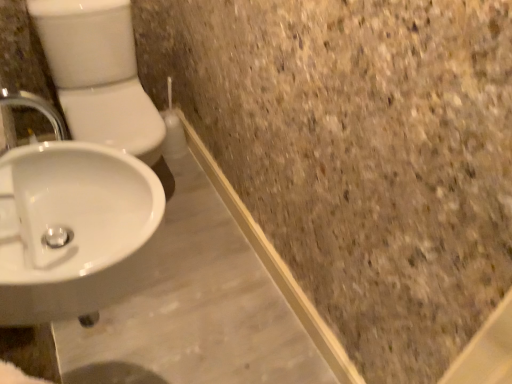
The image size is (512, 384). Describe the element at coordinates (98, 74) in the screenshot. I see `white glossy toilet bowl at left` at that location.

What are the coordinates of `white glossy toilet bowl at left` in the screenshot? It's located at (98, 74).

At what (x,y) coordinates should I click in order to perform the action: click on white glossy sink at lower left. Please return your answer as a coordinate pair (x, y). This screenshot has width=512, height=384. Looking at the image, I should click on (72, 224).

Describe the element at coordinates (72, 224) in the screenshot. This screenshot has height=384, width=512. I see `white glossy sink at lower left` at that location.

Where is `white glossy toilet bowl at left`? The image size is (512, 384). white glossy toilet bowl at left is located at coordinates (98, 74).

Is white glossy toilet bowl at left at the right side of white glossy sink at lower left?

No.

Considering the relative positions of white glossy toilet bowl at left and white glossy sink at lower left in the image provided, is white glossy toilet bowl at left behind white glossy sink at lower left?

That is True.

Between point (123, 75) and point (51, 161), which one is positioned in front?

Point (51, 161)

Consider the image. From the image's perspective, which is below, white glossy toilet bowl at left or white glossy sink at lower left?

white glossy sink at lower left is shown below in the image.

From a real-world perspective, is white glossy toilet bowl at left physically below white glossy sink at lower left?

Indeed, from a real-world perspective, white glossy toilet bowl at left is positioned beneath white glossy sink at lower left.

Looking at this image, considering the sizes of objects white glossy toilet bowl at left and white glossy sink at lower left in the image provided, who is thinner, white glossy toilet bowl at left or white glossy sink at lower left?

With smaller width is white glossy sink at lower left.

Can you confirm if white glossy toilet bowl at left is taller than white glossy sink at lower left?

Yes.

Which of these two, white glossy toilet bowl at left or white glossy sink at lower left, is bigger?

With larger size is white glossy toilet bowl at left.

Is white glossy toilet bowl at left inside or outside of white glossy sink at lower left?

white glossy toilet bowl at left is located beyond the bounds of white glossy sink at lower left.

Is white glossy toilet bowl at left in contact with white glossy sink at lower left?

No, white glossy toilet bowl at left is not with white glossy sink at lower left.

Is white glossy toilet bowl at left facing away from white glossy sink at lower left?

No, white glossy toilet bowl at left is not facing away from white glossy sink at lower left.

Measure the distance between white glossy toilet bowl at left and white glossy sink at lower left.

They are 35.72 inches apart.

The width and height of the screenshot is (512, 384). I want to click on sink on the right of white glossy toilet bowl at left, so click(72, 224).

Is white glossy sink at lower left at the left side of white glossy toilet bowl at left?

No.

Which is behind, white glossy sink at lower left or white glossy toilet bowl at left?

white glossy toilet bowl at left is further from the camera.

Does point (37, 244) come closer to viewer compared to point (102, 30)?

Yes, it is in front of point (102, 30).

From the image's perspective, between white glossy sink at lower left and white glossy toilet bowl at left, who is located below?

white glossy sink at lower left appears lower in the image.

From a real-world perspective, does white glossy sink at lower left sit lower than white glossy toilet bowl at left?

No, from a real-world perspective, white glossy sink at lower left is not beneath white glossy toilet bowl at left.

Considering the relative sizes of white glossy sink at lower left and white glossy toilet bowl at left in the image provided, is white glossy sink at lower left thinner than white glossy toilet bowl at left?

Correct, the width of white glossy sink at lower left is less than that of white glossy toilet bowl at left.

Is white glossy sink at lower left taller or shorter than white glossy toilet bowl at left?

white glossy sink at lower left is shorter than white glossy toilet bowl at left.

Which of these two, white glossy sink at lower left or white glossy toilet bowl at left, is bigger?

white glossy toilet bowl at left.

Is white glossy sink at lower left outside of white glossy toilet bowl at left?

Yes.

Is white glossy sink at lower left next to white glossy toilet bowl at left?

No, white glossy sink at lower left is not in contact with white glossy toilet bowl at left.

Is white glossy sink at lower left facing towards white glossy toilet bowl at left?

No, white glossy sink at lower left is not oriented towards white glossy toilet bowl at left.

Measure the distance between white glossy sink at lower left and white glossy toilet bowl at left.

white glossy sink at lower left and white glossy toilet bowl at left are 35.72 inches apart from each other.

Image resolution: width=512 pixels, height=384 pixels. Identify the location of sink on the right side of white glossy toilet bowl at left. (72, 224).

You are a GUI agent. You are given a task and a screenshot of the screen. Output one action in this format:
    pyautogui.click(x=<x>, y=<y>)
    Task: Click on the toilet bowl beneath the white glossy sink at lower left (from a real-world perspective)
    The width and height of the screenshot is (512, 384).
    Given the screenshot: What is the action you would take?
    [98, 74]

Find the location of a particular element. The width and height of the screenshot is (512, 384). sink on the right of white glossy toilet bowl at left is located at coordinates (72, 224).